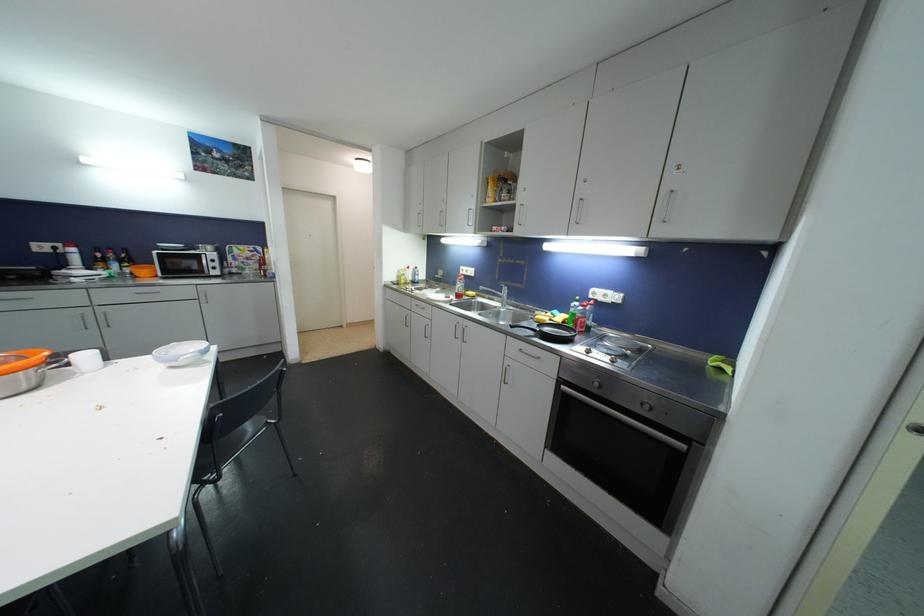
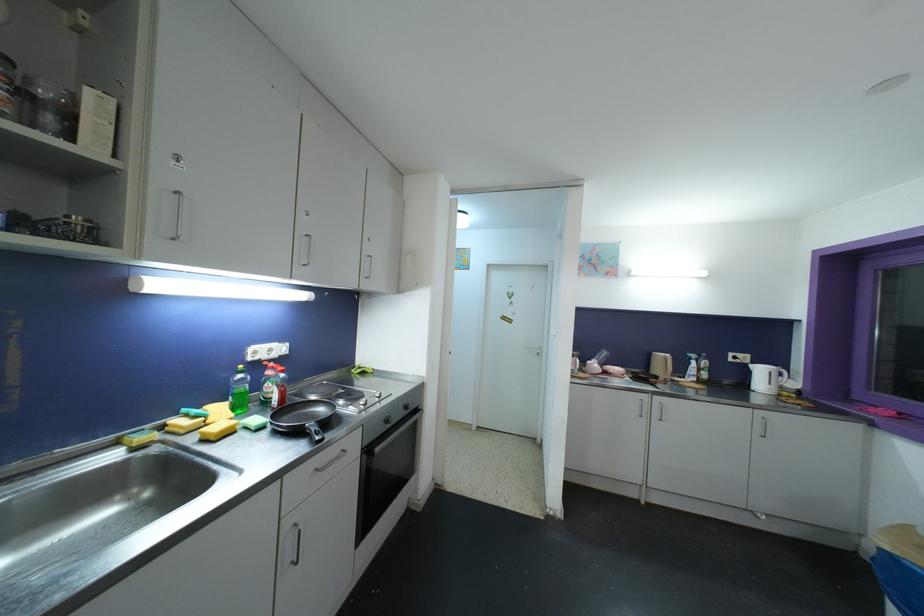
In the second image, find the point that corresponds to pixel 611 357 in the first image.

(366, 400)